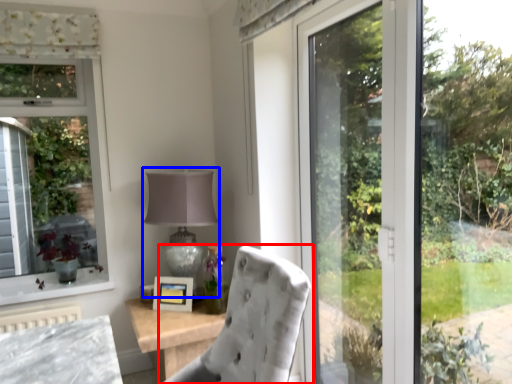
Question: Which object is closer to the camera taking this photo, chair (highlighted by a red box) or table lamp (highlighted by a blue box)?

Choices:
 (A) chair
 (B) table lamp

Answer: (A)